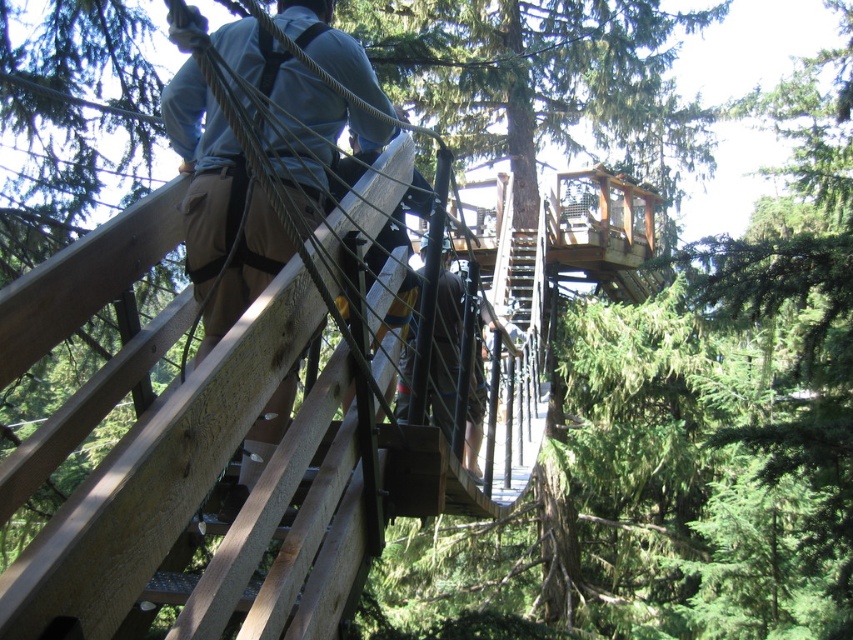
You are planning to cross the suspension bridge and need to know if the brown leather pants at upper left and the brown leather pants at center can both fit side by side on the bridge. Based on their widths, can they fit together?

The brown leather pants at upper left is wider than the brown leather pants at center. Since the bridge is designed for pedestrians, it should have enough width to accommodate both objects side by side, but the exact fit depends on the total width of the bridge. However, based on the given information, there is no indication of the bridge being too narrow for both.

You are a park ranger assessing the suspension bridge for maintenance. You notice two sections of the bridge with brown leather pants at upper left and brown leather pants at center. Which section has more room for pedestrians to walk comfortably?

The brown leather pants at center has more room for pedestrians to walk comfortably because it occupies more space than the brown leather pants at upper left.